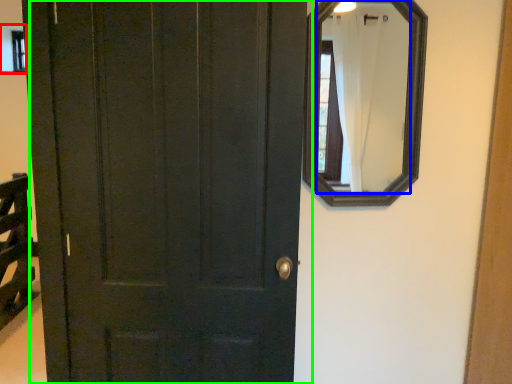
Question: Which is nearer to the window (highlighted by a red box)? mirror (highlighted by a blue box) or door (highlighted by a green box).

Choices:
 (A) mirror
 (B) door

Answer: (B)